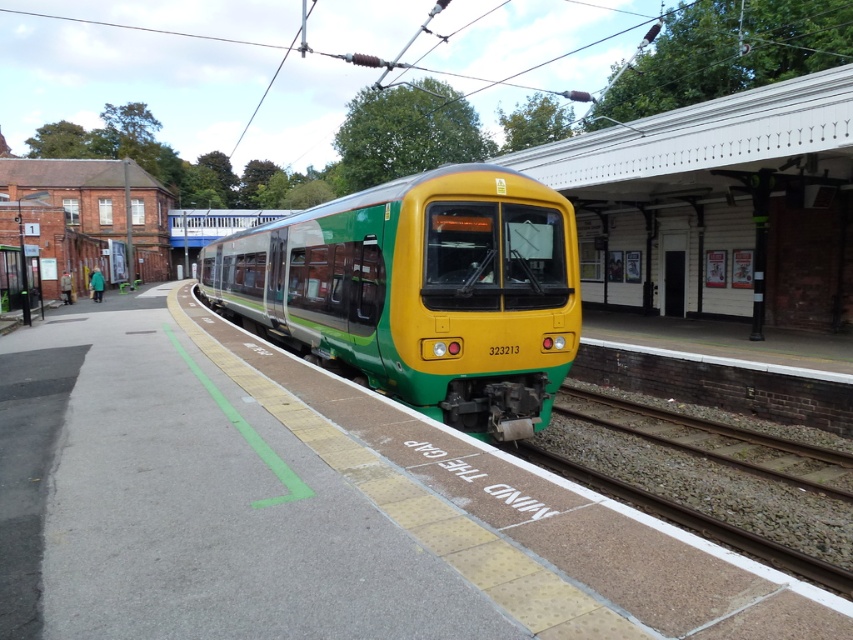
You are a passenger waiting at the train station. You see the green matte train at center and the green gravel train track at lower center. Which object is closer to the left edge of the platform?

The green matte train at center is positioned on the left side of green gravel train track at lower center, so it is closer to the left edge of the platform.

You are standing at the entrance of the station building and want to board the green matte train at center. According to the platform layout, is the train positioned closer to the station building or farther away from it?

The green matte train at center is located at point coordinates that are closer to the station building than the platform edge. Since the train is at the center of the platform, it is positioned closer to the station building compared to the platform edge.

You are a station engineer who needs to ensure the green matte train at center can safely pass through a narrow tunnel entrance that is the same width as the green gravel train track at lower center. Based on the scene, will the train fit through the tunnel?

The green matte train at center is wider than the green gravel train track at lower center, so it will not fit through the tunnel entrance which is the same width as the track.